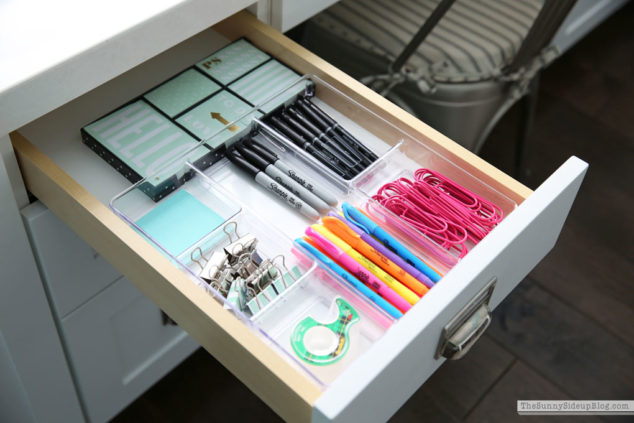
Identify the location of drawer organizer trays. The height and width of the screenshot is (423, 634). (184, 214), (217, 264), (285, 330), (358, 240), (409, 186), (345, 128), (279, 195).